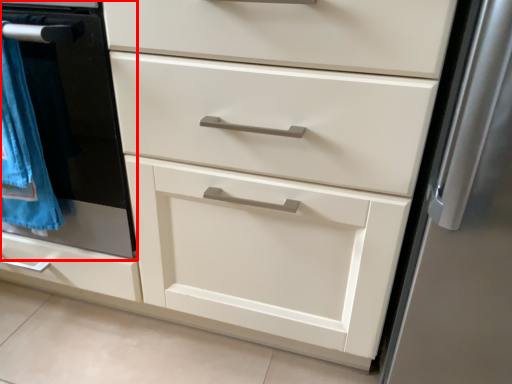
Question: Where is oven (annotated by the red box) located in relation to blanket in the image?

Choices:
 (A) left
 (B) right

Answer: (B)